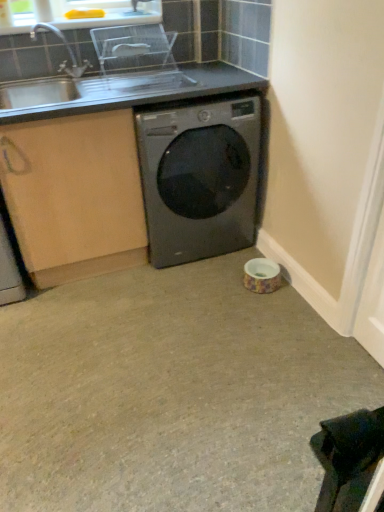
Question: From the image's perspective, is silver metallic sink at upper left located above clear plastic dish rack at upper center?

Choices:
 (A) yes
 (B) no

Answer: (B)

Question: From a real-world perspective, is silver metallic sink at upper left beneath clear plastic dish rack at upper center?

Choices:
 (A) no
 (B) yes

Answer: (B)

Question: Can you confirm if silver metallic sink at upper left is wider than clear plastic dish rack at upper center?

Choices:
 (A) yes
 (B) no

Answer: (A)

Question: Is the position of silver metallic sink at upper left less distant than that of clear plastic dish rack at upper center?

Choices:
 (A) no
 (B) yes

Answer: (B)

Question: Is silver metallic sink at upper left far from clear plastic dish rack at upper center?

Choices:
 (A) yes
 (B) no

Answer: (B)

Question: Is silver metallic sink at upper left at the right side of clear plastic dish rack at upper center?

Choices:
 (A) no
 (B) yes

Answer: (A)

Question: Can you confirm if silver metallic sink at upper left is positioned to the right of satin black washing machine at center?

Choices:
 (A) yes
 (B) no

Answer: (B)

Question: Does silver metallic sink at upper left have a lesser height compared to satin black washing machine at center?

Choices:
 (A) yes
 (B) no

Answer: (A)

Question: Is satin black washing machine at center at the back of silver metallic sink at upper left?

Choices:
 (A) no
 (B) yes

Answer: (A)

Question: Is silver metallic sink at upper left not within satin black washing machine at center?

Choices:
 (A) yes
 (B) no

Answer: (A)

Question: Is silver metallic sink at upper left touching satin black washing machine at center?

Choices:
 (A) yes
 (B) no

Answer: (B)

Question: Does silver metallic sink at upper left have a greater height compared to satin black washing machine at center?

Choices:
 (A) no
 (B) yes

Answer: (A)

Question: Is beige carpet at center bigger than clear plastic dish rack at upper center?

Choices:
 (A) no
 (B) yes

Answer: (B)